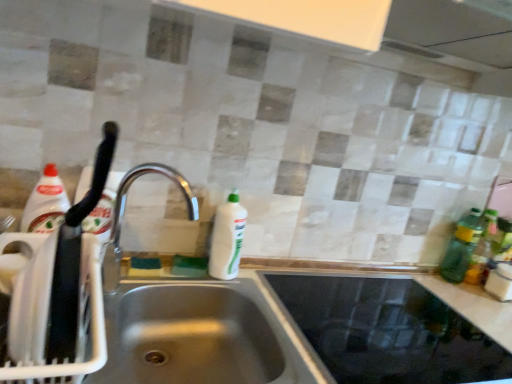
The width and height of the screenshot is (512, 384). I want to click on vacant space that is to the left of green translucent bottle at right, positioned as the 1th bottle in left-to-right order, so click(417, 274).